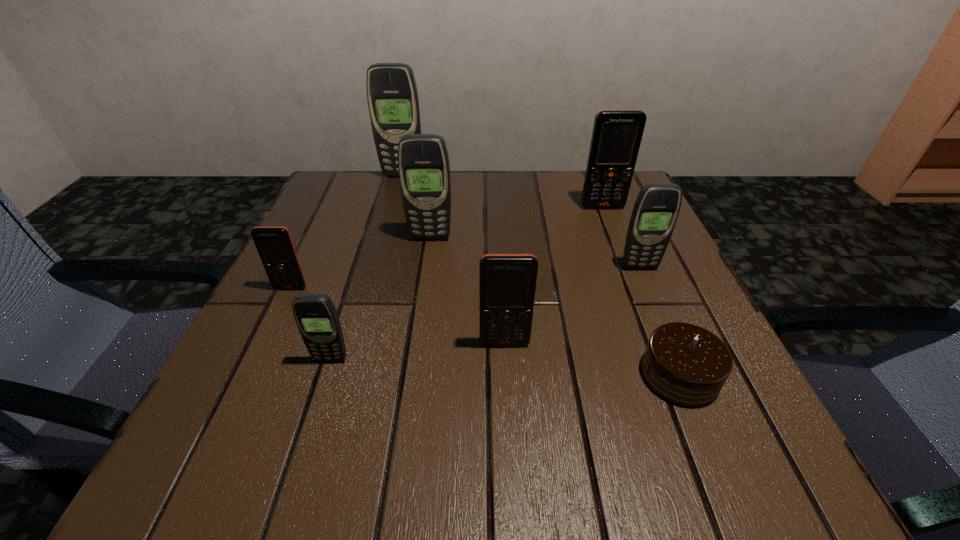
Find the location of a particular element. The image size is (960, 540). the farthest object is located at coordinates (392, 95).

You are a GUI agent. You are given a task and a screenshot of the screen. Output one action in this format:
    pyautogui.click(x=<x>, y=<y>)
    Task: Click on the farthest cellular telephone
    
    Given the screenshot: What is the action you would take?
    pyautogui.click(x=392, y=95)

The height and width of the screenshot is (540, 960). I want to click on the farthest orange cellular telephone, so click(x=617, y=134).

The height and width of the screenshot is (540, 960). I want to click on the seventh nearest object, so click(x=617, y=134).

You are a GUI agent. You are given a task and a screenshot of the screen. Output one action in this format:
    pyautogui.click(x=<x>, y=<y>)
    Task: Click on the third smallest gray cellular telephone
    Image resolution: width=960 pixels, height=540 pixels.
    Given the screenshot: What is the action you would take?
    pyautogui.click(x=423, y=163)

At what (x,y) coordinates should I click in order to perform the action: click on the fifth nearest cellular telephone. Please return your answer as a coordinate pair (x, y). Looking at the image, I should click on (423, 163).

Identify the location of the third farthest gray cellular telephone. (656, 209).

The image size is (960, 540). What are the coordinates of `the fourth nearest cellular telephone` in the screenshot? It's located at (656, 209).

Identify the location of the second orange cellular telephone from left to right. The width and height of the screenshot is (960, 540). (507, 282).

You are a GUI agent. You are given a task and a screenshot of the screen. Output one action in this format:
    pyautogui.click(x=<x>, y=<y>)
    Task: Click on the sixth farthest cellular telephone
    
    Given the screenshot: What is the action you would take?
    pyautogui.click(x=507, y=282)